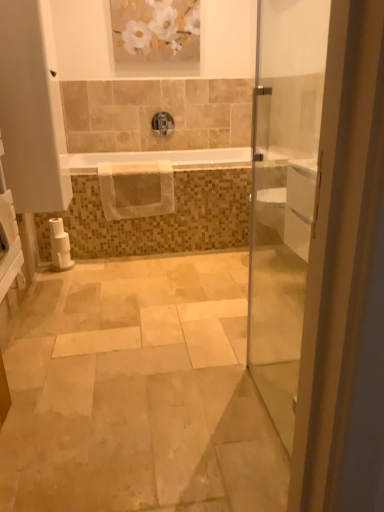
I want to click on free spot behind white glossy door at right, so click(250, 361).